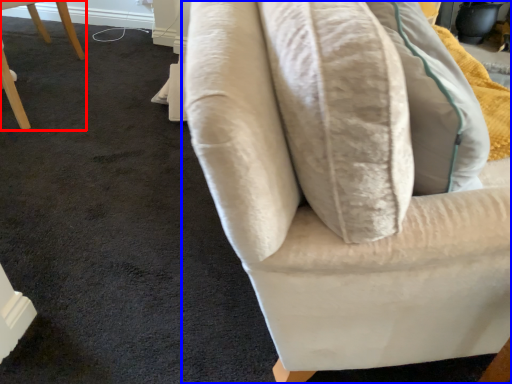
Question: Which of the following is the closest to the observer, chair (highlighted by a red box) or furniture (highlighted by a blue box)?

Choices:
 (A) chair
 (B) furniture

Answer: (B)